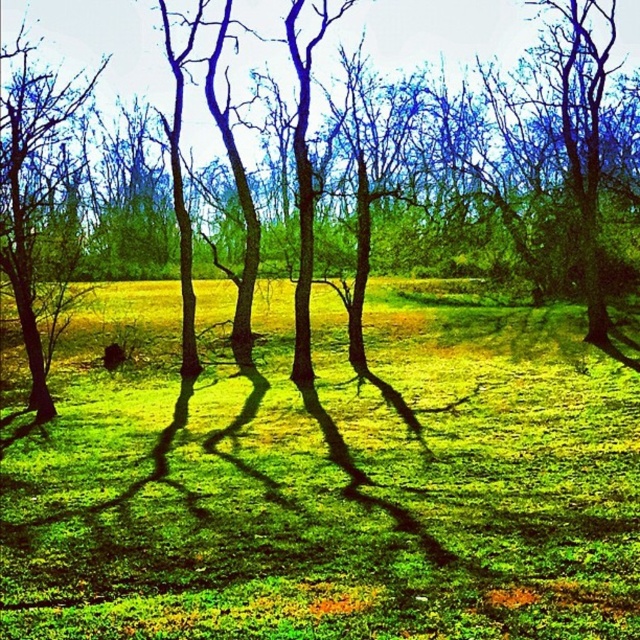
Looking at this image, between green grass at center and green matte tree at center, which one has less height?

green grass at center

Does green grass at center have a lesser width compared to green matte tree at center?

Indeed, green grass at center has a lesser width compared to green matte tree at center.

Who is more distant from viewer, (x=371, y=616) or (x=618, y=60)?

Point (x=618, y=60)

Find the location of a particular element. This screenshot has width=640, height=640. green grass at center is located at coordinates click(x=326, y=481).

Between green matte tree at center and smooth bark tree at left, which one appears on the left side from the viewer's perspective?

Positioned to the left is smooth bark tree at left.

Is point (449, 64) closer to viewer compared to point (10, 182)?

No, it is not.

In order to click on green matte tree at center in this screenshot , I will do `click(429, 29)`.

Does green grass at center appear on the right side of smooth bark tree at left?

Indeed, green grass at center is positioned on the right side of smooth bark tree at left.

Can you confirm if green grass at center is thinner than smooth bark tree at left?

In fact, green grass at center might be wider than smooth bark tree at left.

Who is more forward, (237, 476) or (60, 284)?

Point (237, 476)

You are a GUI agent. You are given a task and a screenshot of the screen. Output one action in this format:
    pyautogui.click(x=<x>, y=<y>)
    Task: Click on the green grass at center
    This screenshot has height=640, width=640.
    Given the screenshot: What is the action you would take?
    pyautogui.click(x=326, y=481)